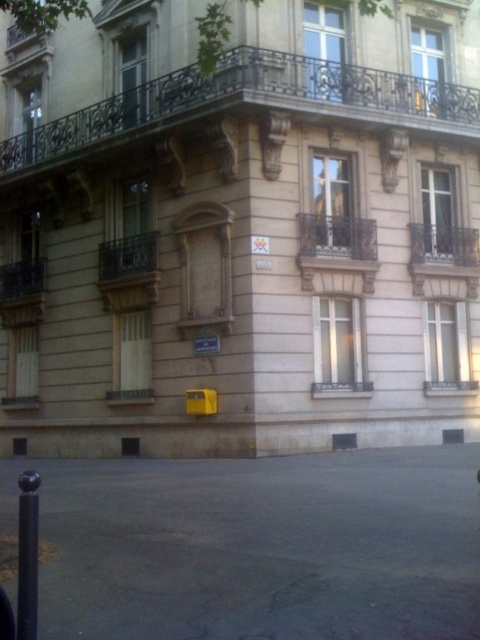
Does dark brown wrought iron balcony at center lie behind polished metal balcony at upper right?

Answer: No, it is in front of polished metal balcony at upper right.

Which is more to the left, dark brown wrought iron balcony at center or polished metal balcony at upper right?

dark brown wrought iron balcony at center is more to the left.

In the scene shown: Who is more distant from viewer, (344, 244) or (415, 244)?

The point (415, 244) is more distant.

In order to click on dark brown wrought iron balcony at center in this screenshot , I will do `click(336, 237)`.

Between dark brown wrought iron balcony at left and polished metal balcony at upper right, which one is positioned higher?

Positioned higher is polished metal balcony at upper right.

Identify the location of dark brown wrought iron balcony at left. This screenshot has height=640, width=480. (22, 292).

Looking at this image, who is higher up, dark brown wrought iron balcony at upper center or dark brown wrought iron balcony at left?

Positioned higher is dark brown wrought iron balcony at upper center.

Is dark brown wrought iron balcony at upper center below dark brown wrought iron balcony at left?

Incorrect, dark brown wrought iron balcony at upper center is not positioned below dark brown wrought iron balcony at left.

Where is `dark brown wrought iron balcony at upper center`? dark brown wrought iron balcony at upper center is located at coordinates coord(247,106).